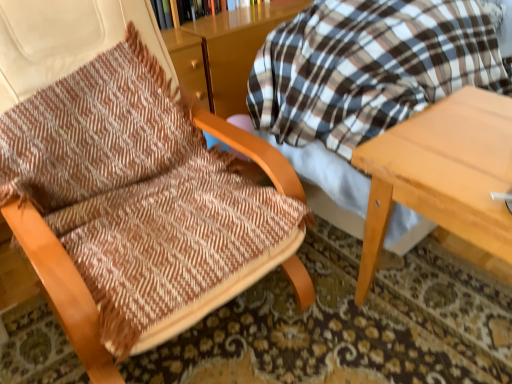
In the scene shown: Measure the distance between wooden bookcase at upper center and camera.

wooden bookcase at upper center and camera are 5.72 feet apart.

Where is `brown woven fabric chair at left`? brown woven fabric chair at left is located at coordinates (135, 192).

Which object is further away from the camera, wooden bookcase at upper center or light wood table at right?

wooden bookcase at upper center is behind.

From the picture: Would you say wooden bookcase at upper center is to the left or to the right of light wood table at right in the picture?

From the image, it's evident that wooden bookcase at upper center is to the left of light wood table at right.

Is point (165, 13) in front of point (385, 143)?

No, it is not.

Who is more distant, brown woven fabric chair at left or wooden bookcase at upper center?

Positioned behind is wooden bookcase at upper center.

Considering the points (147, 152) and (232, 4), which point is behind, point (147, 152) or point (232, 4)?

Point (232, 4)

Are brown woven fabric chair at left and wooden bookcase at upper center beside each other?

They are not placed beside each other.

Identify the location of bookcase above the brown woven fabric chair at left (from a real-world perspective). This screenshot has width=512, height=384. (195, 10).

Can you confirm if wooden bookcase at upper center is bigger than brown woven fabric chair at left?

No.

Does wooden bookcase at upper center appear on the left side of brown woven fabric chair at left?

No.

How different are the orientations of wooden bookcase at upper center and brown woven fabric chair at left in degrees?

The angle between the facing direction of wooden bookcase at upper center and the facing direction of brown woven fabric chair at left is 1.39 degrees.

Is point (199, 17) closer or farther from the camera than point (143, 171)?

Clearly, point (199, 17) is more distant from the camera than point (143, 171).

What's the angular difference between light wood table at right and brown woven fabric chair at left's facing directions?

light wood table at right and brown woven fabric chair at left are facing 90.1 degrees away from each other.

Looking at this image, from a real-world perspective, does light wood table at right stand above brown woven fabric chair at left?

No, from a real-world perspective, light wood table at right is not above brown woven fabric chair at left.

Could you tell me if light wood table at right is turned towards brown woven fabric chair at left?

No, light wood table at right is not facing towards brown woven fabric chair at left.

Which is more to the right, light wood table at right or brown woven fabric chair at left?

light wood table at right.

From the image's perspective, between light wood table at right and wooden bookcase at upper center, which one is located above?

wooden bookcase at upper center.

Is light wood table at right completely or partially outside of wooden bookcase at upper center?

That's correct, light wood table at right is outside of wooden bookcase at upper center.

Looking at this image, is light wood table at right to the left or to the right of wooden bookcase at upper center in the image?

Based on their positions, light wood table at right is located to the right of wooden bookcase at upper center.

Between brown woven fabric chair at left and light wood table at right, which one appears on the right side from the viewer's perspective?

Positioned to the right is light wood table at right.

Would you say brown woven fabric chair at left is inside or outside light wood table at right?

brown woven fabric chair at left is located beyond the bounds of light wood table at right.

Could you tell me if brown woven fabric chair at left is turned towards light wood table at right?

No, brown woven fabric chair at left is not oriented towards light wood table at right.

Is brown woven fabric chair at left wider or thinner than light wood table at right?

Considering their sizes, brown woven fabric chair at left looks broader than light wood table at right.

The image size is (512, 384). Find the location of `bookcase that is behind the light wood table at right`. bookcase that is behind the light wood table at right is located at coordinates (195, 10).

You are a GUI agent. You are given a task and a screenshot of the screen. Output one action in this format:
    pyautogui.click(x=<x>, y=<y>)
    Task: Click on the chair that appears on the left of wooden bookcase at upper center
    This screenshot has width=512, height=384.
    Given the screenshot: What is the action you would take?
    pyautogui.click(x=135, y=192)

Considering their positions, is light wood table at right positioned further to brown woven fabric chair at left than wooden bookcase at upper center?

wooden bookcase at upper center lies further to brown woven fabric chair at left than the other object.

Considering their positions, is wooden bookcase at upper center positioned closer to brown woven fabric chair at left than light wood table at right?

The object closer to brown woven fabric chair at left is light wood table at right.

Based on their spatial positions, is brown woven fabric chair at left or light wood table at right closer to wooden bookcase at upper center?

brown woven fabric chair at left lies closer to wooden bookcase at upper center than the other object.

Looking at the image, which one is located closer to wooden bookcase at upper center, light wood table at right or brown woven fabric chair at left?

The object closer to wooden bookcase at upper center is brown woven fabric chair at left.

When comparing their distances from light wood table at right, does brown woven fabric chair at left or wooden bookcase at upper center seem closer?

brown woven fabric chair at left lies closer to light wood table at right than the other object.

When comparing their distances from light wood table at right, does wooden bookcase at upper center or brown woven fabric chair at left seem closer?

brown woven fabric chair at left lies closer to light wood table at right than the other object.

Identify the location of table between brown woven fabric chair at left and wooden bookcase at upper center along the z-axis. This screenshot has width=512, height=384. (442, 174).